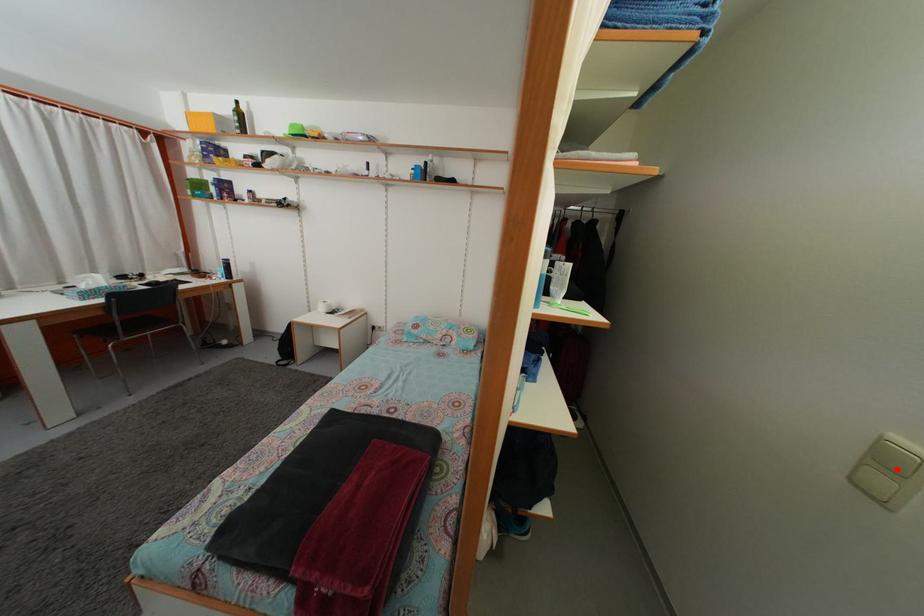
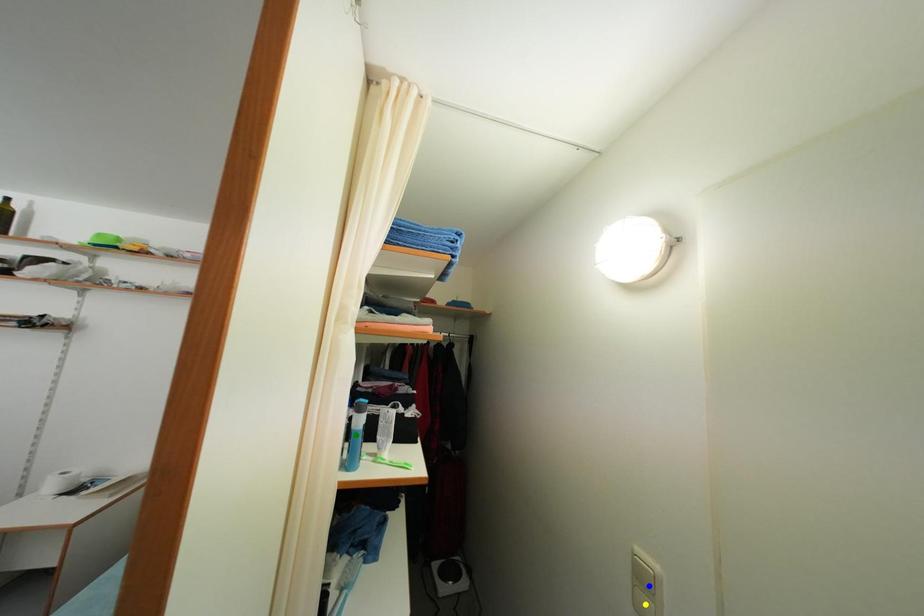
Question: I am providing you with two images of the same scene from different viewpoints. A red point is marked on the first image. You are given multiple points on the second image. Which point in image 2 is actually the same real-world point as the red point in image 1?

Choices:
 (A) blue point
 (B) green point
 (C) yellow point

Answer: (A)